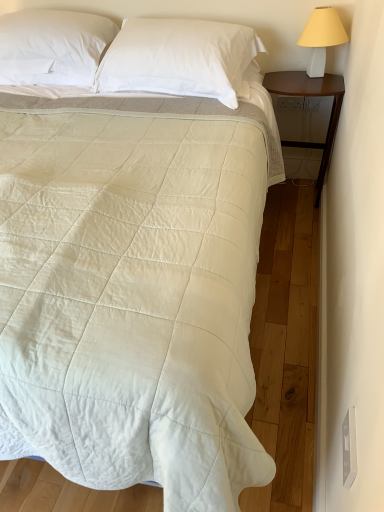
The width and height of the screenshot is (384, 512). I want to click on vacant area on top of dark wood nightstand at right (from a real-world perspective), so click(308, 79).